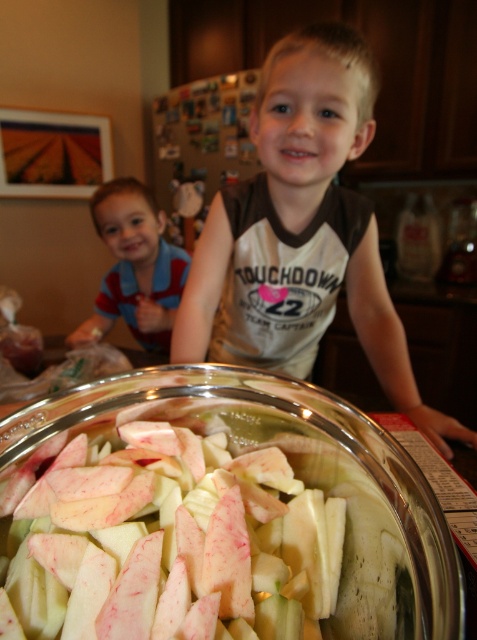
Describe the element at coordinates (301, 232) in the screenshot. The image size is (477, 640). I see `white cotton shirt at center` at that location.

Who is more distant from viewer, [371,212] or [128,216]?

Point [128,216]

Who is more distant from viewer, (x=289, y=272) or (x=109, y=195)?

The point (x=109, y=195) is more distant.

Locate an element on the screen. Image resolution: width=477 pixels, height=640 pixels. white cotton shirt at center is located at coordinates (301, 232).

Who is taller, clear glass bowl at center or striped shirt at left?

With more height is striped shirt at left.

Where is `clear glass bowl at center`? clear glass bowl at center is located at coordinates (217, 516).

Is point (298, 616) in front of point (371, 346)?

Yes, it is in front of point (371, 346).

Can you confirm if clear glass bowl at center is shorter than white cotton shirt at center?

Indeed, clear glass bowl at center has a lesser height compared to white cotton shirt at center.

The width and height of the screenshot is (477, 640). Describe the element at coordinates (217, 516) in the screenshot. I see `clear glass bowl at center` at that location.

This screenshot has width=477, height=640. I want to click on clear glass bowl at center, so click(217, 516).